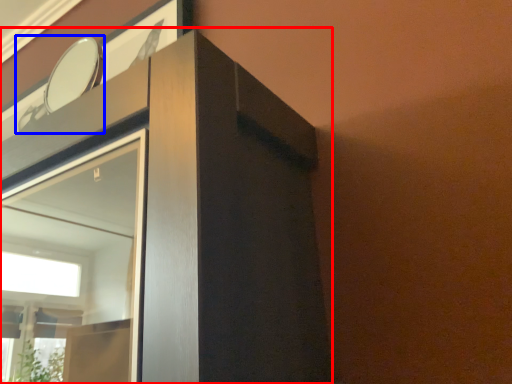
Question: Which object appears farthest to the camera in this image, dresser (highlighted by a red box) or mirror (highlighted by a blue box)?

Choices:
 (A) dresser
 (B) mirror

Answer: (B)